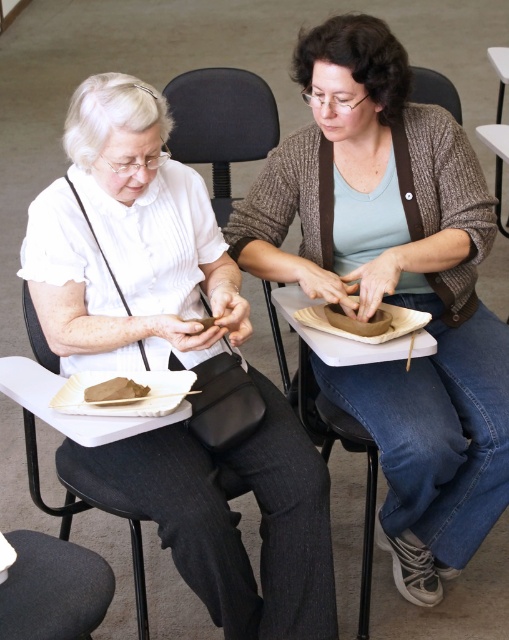
Question: Can you confirm if black plastic chair at upper center is positioned to the left of brown paper bag at lower left?

Choices:
 (A) yes
 (B) no

Answer: (B)

Question: Which object is closer to the camera taking this photo?

Choices:
 (A) brown paper bag at lower left
 (B) matte black purse at lower left
 (C) black plastic chair at upper center

Answer: (B)

Question: Considering the relative positions of brown paper bag at lower left and matte brown bowl at center in the image provided, where is brown paper bag at lower left located with respect to matte brown bowl at center?

Choices:
 (A) right
 (B) left

Answer: (B)

Question: Which point is farther to the camera?

Choices:
 (A) matte brown bowl at center
 (B) matte brown clay pot at center
 (C) brown paper bag at lower left
 (D) black plastic chair at upper center

Answer: (D)

Question: Does matte black purse at lower left have a greater width compared to matte brown bowl at center?

Choices:
 (A) no
 (B) yes

Answer: (B)

Question: Which of these objects is positioned farthest from the knitted fabric chair at center?

Choices:
 (A) brown paper bag at lower left
 (B) matte brown clay pot at center
 (C) black plastic chair at upper center
 (D) white plastic table at center

Answer: (A)